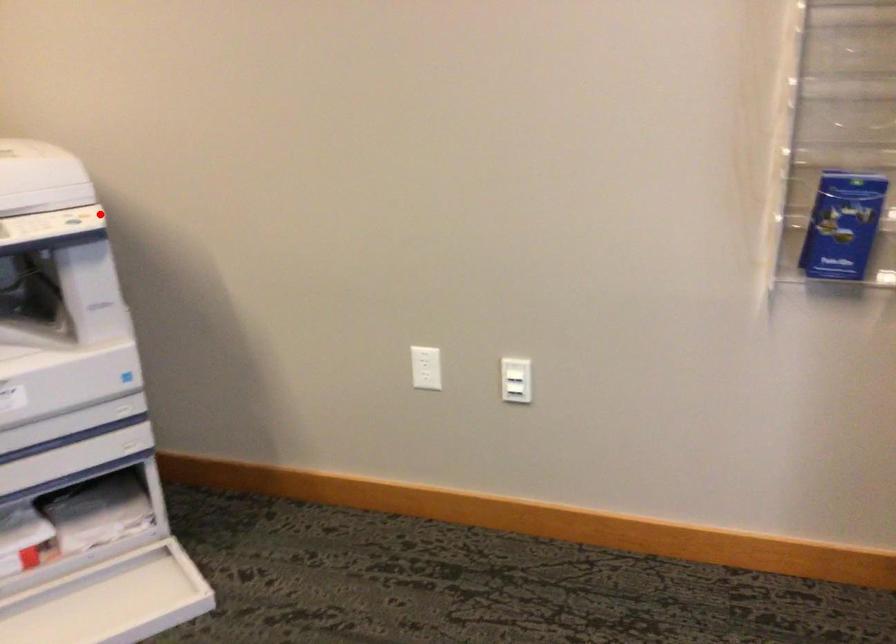
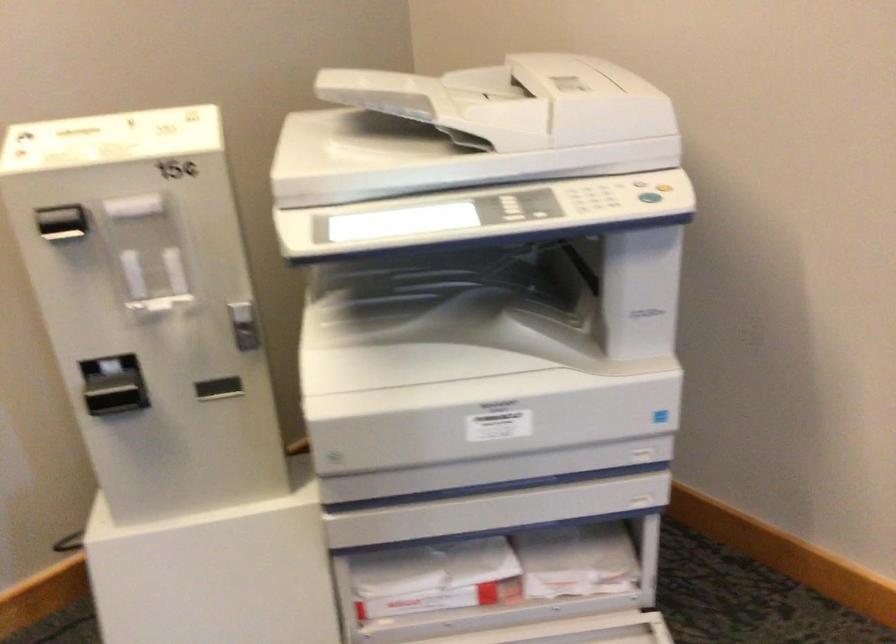
In the second image, find the point that corresponds to the highlighted location in the first image.

(664, 185)